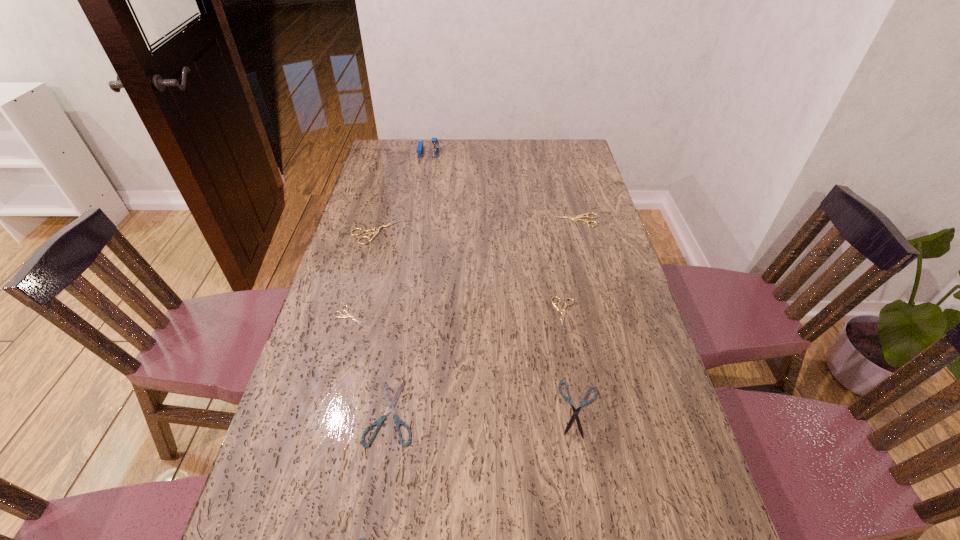
Select which object is the fourth closest to the third biggest beige shears. Please provide its 2D coordinates. Your answer should be formatted as a tuple, i.e. [(x, y)], where the tuple contains the x and y coordinates of a point satisfying the conditions above.

[(341, 315)]

Image resolution: width=960 pixels, height=540 pixels. In order to click on shears that is the closest one to the nearest object in this screenshot , I will do `click(391, 404)`.

Locate which shears is the third closest to the biggest black shears. Please provide its 2D coordinates. Your answer should be formatted as a tuple, i.e. [(x, y)], where the tuple contains the x and y coordinates of a point satisfying the conditions above.

[(575, 411)]

Identify which beige shears is the second closest to the biggest black shears. Please provide its 2D coordinates. Your answer should be formatted as a tuple, i.e. [(x, y)], where the tuple contains the x and y coordinates of a point satisfying the conditions above.

[(558, 308)]

Locate an element on the screen. Image resolution: width=960 pixels, height=540 pixels. the third closest beige shears to the farthest object is located at coordinates (341, 315).

Where is `the closest black shears relative to the farthest object`? The image size is (960, 540). the closest black shears relative to the farthest object is located at coordinates (391, 404).

Image resolution: width=960 pixels, height=540 pixels. What are the coordinates of `black shears that is the closest to the third biggest beige shears` in the screenshot? It's located at (575, 411).

Locate an element on the screen. Image resolution: width=960 pixels, height=540 pixels. vacant region that satisfies the following two spatial constraints: 1. on the back side of the smallest beige shears; 2. on the right side of the second smallest beige shears is located at coordinates (349, 313).

Locate an element on the screen. This screenshot has width=960, height=540. free spot that satisfies the following two spatial constraints: 1. on the back side of the farthest object; 2. on the left side of the biggest beige shears is located at coordinates (397, 152).